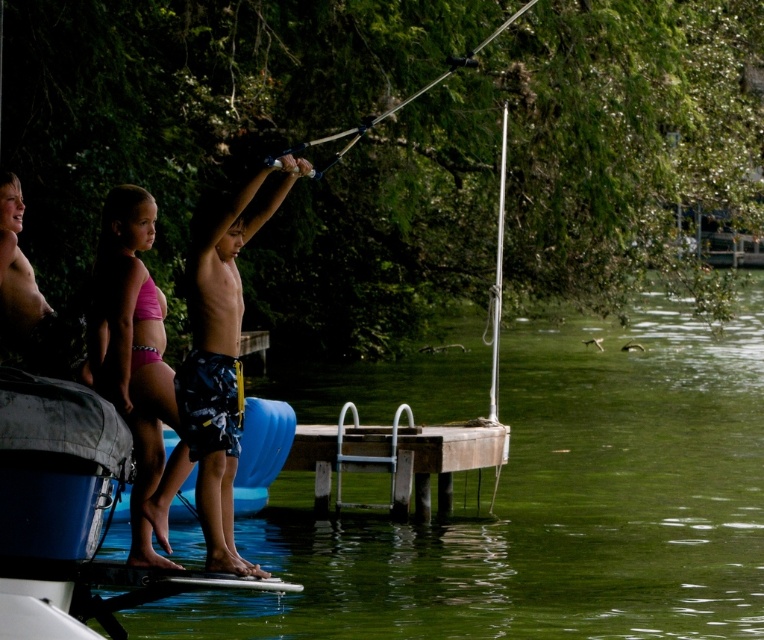
Question: Which point is closer to the camera taking this photo?

Choices:
 (A) (639, 499)
 (B) (351, 465)

Answer: (B)

Question: Does brown wooden dock at center have a larger size compared to metallic silver fishing pole at upper center?

Choices:
 (A) no
 (B) yes

Answer: (A)

Question: Where is green water at center located in relation to dark blue swim trunks at center in the image?

Choices:
 (A) left
 (B) right

Answer: (B)

Question: Which object is the closest to the brown wooden dock at center?

Choices:
 (A) metallic silver fishing pole at upper center
 (B) pink fabric bikini at left

Answer: (A)

Question: Is green water at center thinner than metallic silver fishing pole at upper center?

Choices:
 (A) yes
 (B) no

Answer: (B)

Question: Which point appears farthest from the camera in this image?

Choices:
 (A) (118, 208)
 (B) (368, 129)

Answer: (B)